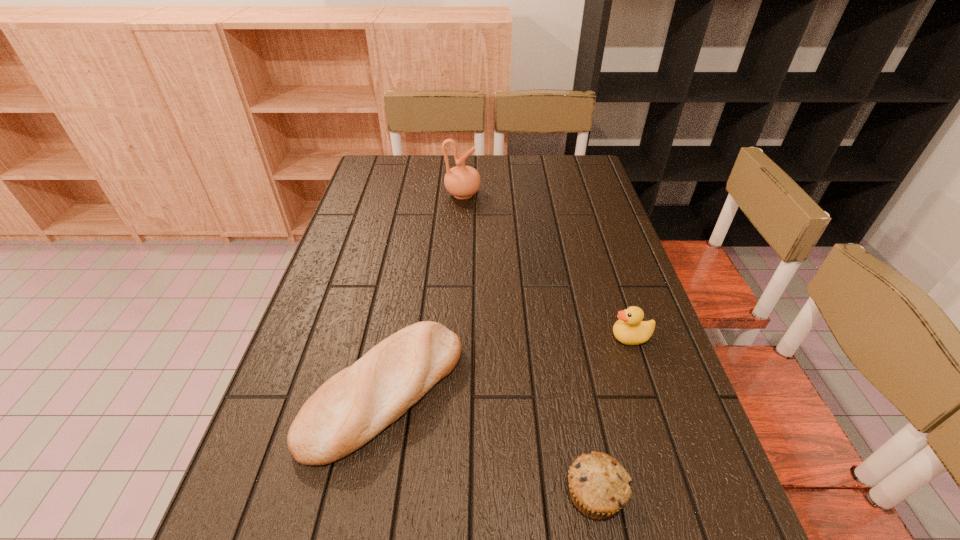
Image resolution: width=960 pixels, height=540 pixels. Identify the location of the farthest object. (x=461, y=181).

This screenshot has width=960, height=540. What are the coordinates of `pottery` in the screenshot? It's located at (461, 181).

Identify the location of duck. Image resolution: width=960 pixels, height=540 pixels. (630, 329).

Where is `bread`? The width and height of the screenshot is (960, 540). bread is located at coordinates (353, 406).

The width and height of the screenshot is (960, 540). In order to click on muffin in this screenshot , I will do `click(599, 486)`.

The width and height of the screenshot is (960, 540). I want to click on free region located 0.300m on the spout of the pottery, so click(568, 194).

Find the location of a particular element. The image size is (960, 540). vacant area located 0.260m at the beak of the duck is located at coordinates (501, 337).

Locate an element on the screen. free location located at the beak of the duck is located at coordinates (568, 337).

Where is `free space located at the beak of the duck`? This screenshot has height=540, width=960. free space located at the beak of the duck is located at coordinates (556, 337).

You are a GUI agent. You are given a task and a screenshot of the screen. Output one action in this format:
    pyautogui.click(x=<x>, y=<y>)
    Task: Click on the free spot located on the right of the bread
    This screenshot has height=540, width=960.
    Given the screenshot: What is the action you would take?
    pyautogui.click(x=537, y=391)